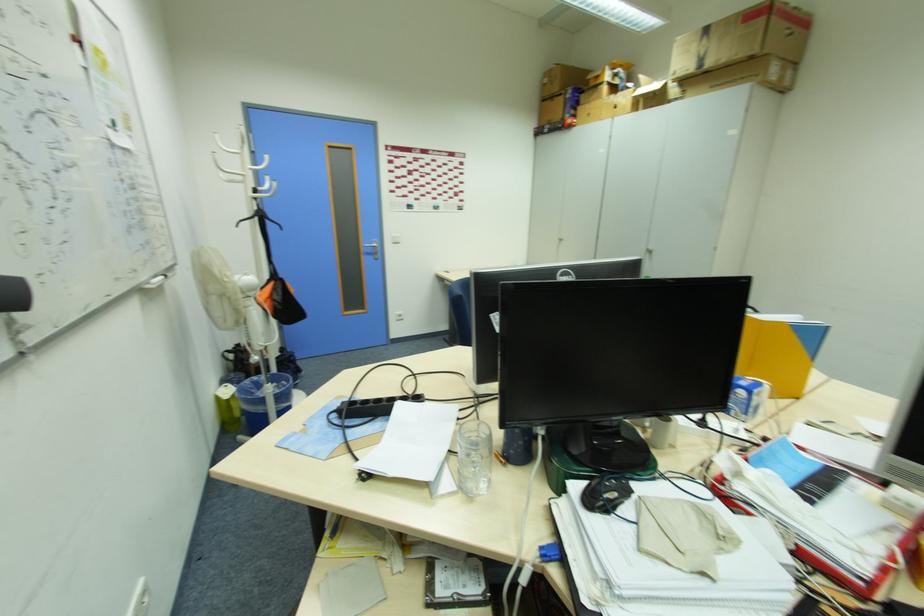
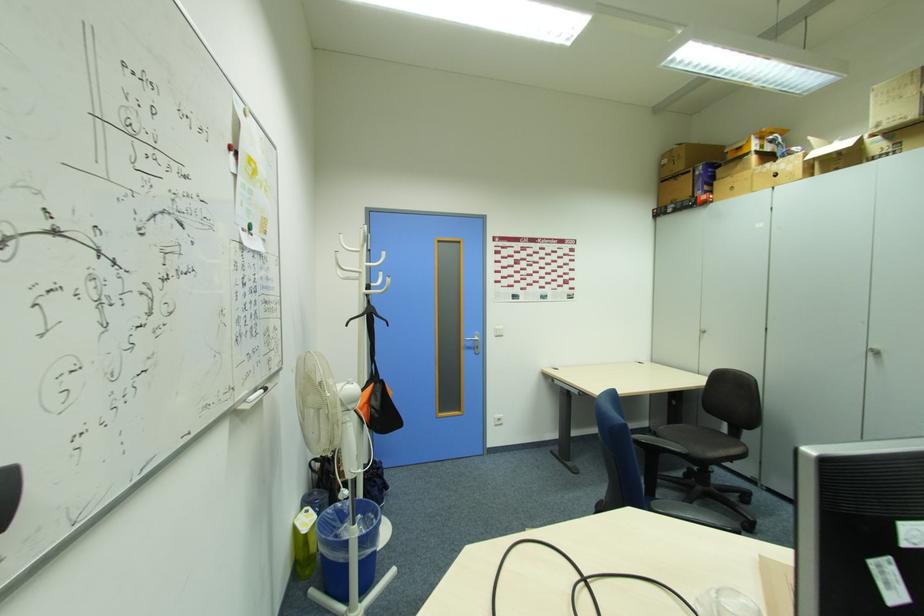
The images are taken continuously from a first-person perspective. In which direction are you moving?

The cameraman walked toward left, forward.